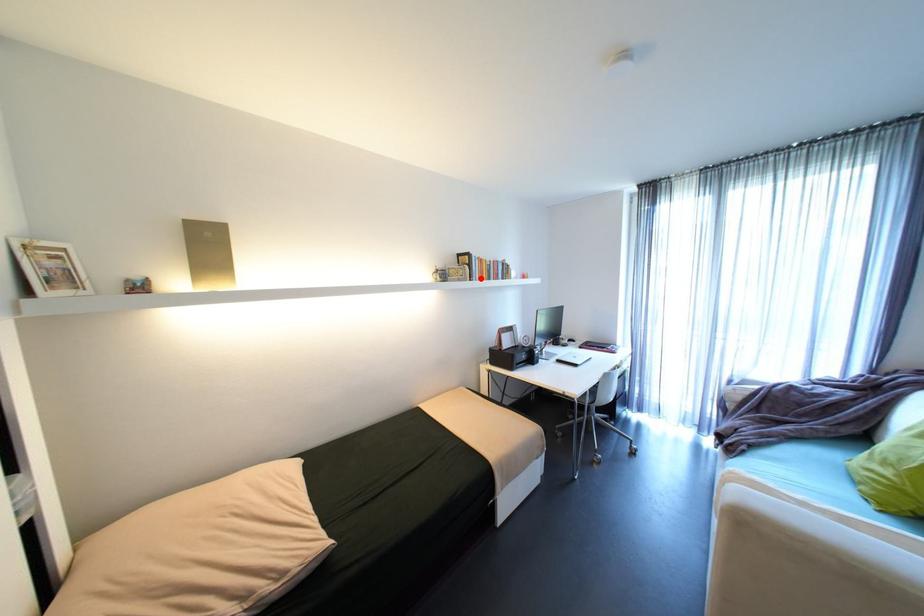
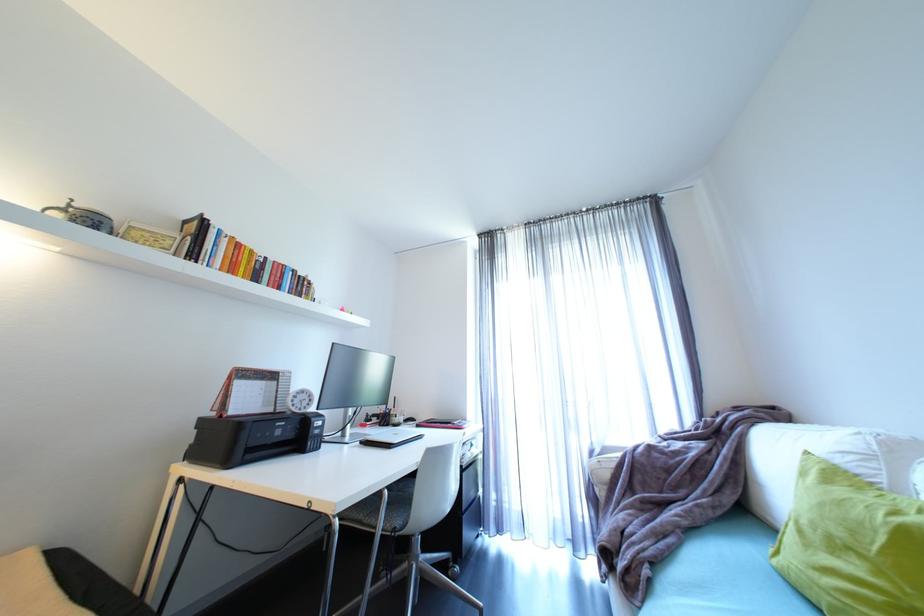
Question: I am providing you with two images of the same scene from different viewpoints. A red point is marked on the first image. At the location where the point appears in image 1, is it still visible in image 2?

Choices:
 (A) Yes
 (B) No

Answer: (A)